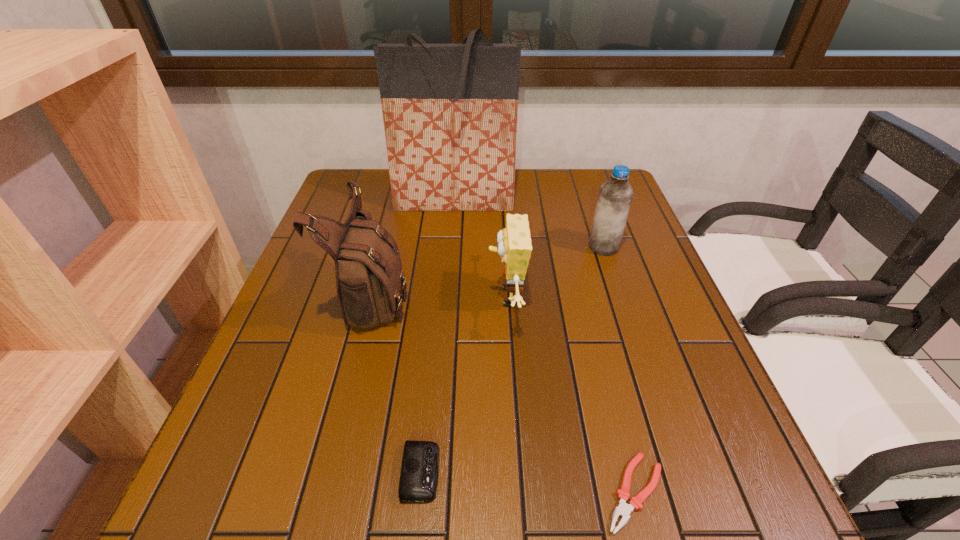
Identify the location of free space located on the face of the fourth tallest object. This screenshot has width=960, height=540. (337, 298).

Locate an element on the screen. blank space located on the face of the fourth tallest object is located at coordinates (427, 298).

Locate an element on the screen. This screenshot has height=540, width=960. vacant space located 0.130m on the face of the fourth tallest object is located at coordinates (432, 298).

Identify the location of vacant space located on the display of the second shortest object. (481, 472).

Find the location of a particular element. free space located on the left of the pliers is located at coordinates (425, 492).

Where is `object at the far edge`? The width and height of the screenshot is (960, 540). object at the far edge is located at coordinates (x=450, y=111).

Find the location of a particular element. Image resolution: width=960 pixels, height=540 pixels. alarm clock that is at the near edge is located at coordinates (418, 481).

The width and height of the screenshot is (960, 540). In order to click on pliers located at the near edge in this screenshot , I will do `click(623, 509)`.

This screenshot has width=960, height=540. I want to click on object that is positioned at the left edge, so click(x=369, y=278).

At what (x,y) coordinates should I click in order to perform the action: click on water bottle located at the right edge. Please return your answer as a coordinate pair (x, y). Looking at the image, I should click on (615, 196).